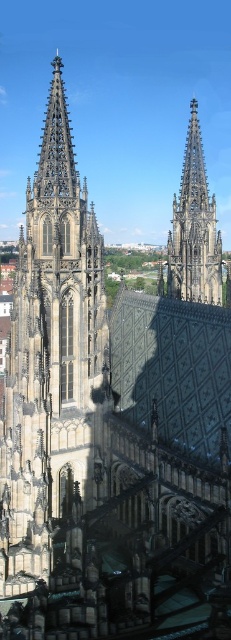
Question: Is dark gray stone tower at left positioned before dark gray stone spire at center?

Choices:
 (A) no
 (B) yes

Answer: (B)

Question: Which object is closer to the camera taking this photo?

Choices:
 (A) dark gray stone spire at center
 (B) dark gray stone tower at left

Answer: (B)

Question: Does dark gray stone tower at left have a lesser width compared to dark gray stone spire at center?

Choices:
 (A) yes
 (B) no

Answer: (B)

Question: Does dark gray stone tower at left appear under dark gray stone spire at center?

Choices:
 (A) yes
 (B) no

Answer: (A)

Question: Which point is farther from the camera taking this photo?

Choices:
 (A) click(209, 237)
 (B) click(54, 147)

Answer: (A)